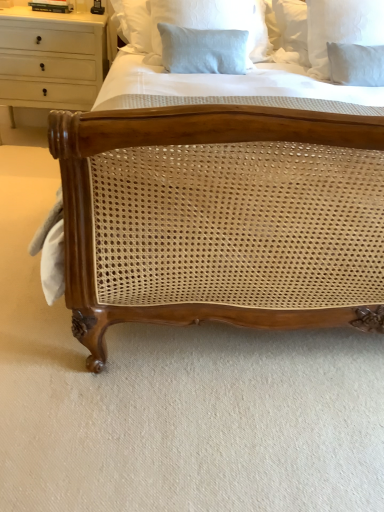
Question: Does white wood chest of drawers at upper left have a smaller size compared to white linen pillow at upper right, which is counted as the 1th pillow, starting from the right?

Choices:
 (A) yes
 (B) no

Answer: (B)

Question: From a real-world perspective, is white wood chest of drawers at upper left under white linen pillow at upper right, arranged as the 2th pillow when viewed from the left?

Choices:
 (A) yes
 (B) no

Answer: (A)

Question: Can you see white wood chest of drawers at upper left touching white linen pillow at upper right, arranged as the 2th pillow when viewed from the left?

Choices:
 (A) no
 (B) yes

Answer: (A)

Question: Is white wood chest of drawers at upper left aimed at white linen pillow at upper right, arranged as the 2th pillow when viewed from the left?

Choices:
 (A) yes
 (B) no

Answer: (B)

Question: Is white wood chest of drawers at upper left further to the viewer compared to white linen pillow at upper right, arranged as the 2th pillow when viewed from the left?

Choices:
 (A) no
 (B) yes

Answer: (B)

Question: Is white wood chest of drawers at upper left facing away from white linen pillow at upper right, which is counted as the 1th pillow, starting from the right?

Choices:
 (A) yes
 (B) no

Answer: (B)

Question: From the image's perspective, does white linen pillow at upper right, which is counted as the 1th pillow, starting from the right, appear lower than light blue linen pillow at upper center, the 1th pillow from the left?

Choices:
 (A) no
 (B) yes

Answer: (B)

Question: Can you confirm if white linen pillow at upper right, arranged as the 2th pillow when viewed from the left, is wider than light blue linen pillow at upper center, the 1th pillow from the left?

Choices:
 (A) no
 (B) yes

Answer: (B)

Question: From a real-world perspective, is white linen pillow at upper right, arranged as the 2th pillow when viewed from the left, on light blue linen pillow at upper center, the 1th pillow from the left?

Choices:
 (A) no
 (B) yes

Answer: (A)

Question: Can we say white linen pillow at upper right, which is counted as the 1th pillow, starting from the right, lies outside light blue linen pillow at upper center, arranged as the 2th pillow when viewed from the right?

Choices:
 (A) yes
 (B) no

Answer: (A)

Question: Considering the relative sizes of white linen pillow at upper right, which is counted as the 1th pillow, starting from the right, and light blue linen pillow at upper center, arranged as the 2th pillow when viewed from the right, in the image provided, is white linen pillow at upper right, which is counted as the 1th pillow, starting from the right, taller than light blue linen pillow at upper center, arranged as the 2th pillow when viewed from the right,?

Choices:
 (A) no
 (B) yes

Answer: (B)

Question: Does white linen pillow at upper right, arranged as the 2th pillow when viewed from the left, appear on the right side of light blue linen pillow at upper center, arranged as the 2th pillow when viewed from the right?

Choices:
 (A) yes
 (B) no

Answer: (A)

Question: From the image's perspective, does white linen pillow at upper right, which is counted as the 1th pillow, starting from the right, appear higher than white wood chest of drawers at upper left?

Choices:
 (A) no
 (B) yes

Answer: (A)